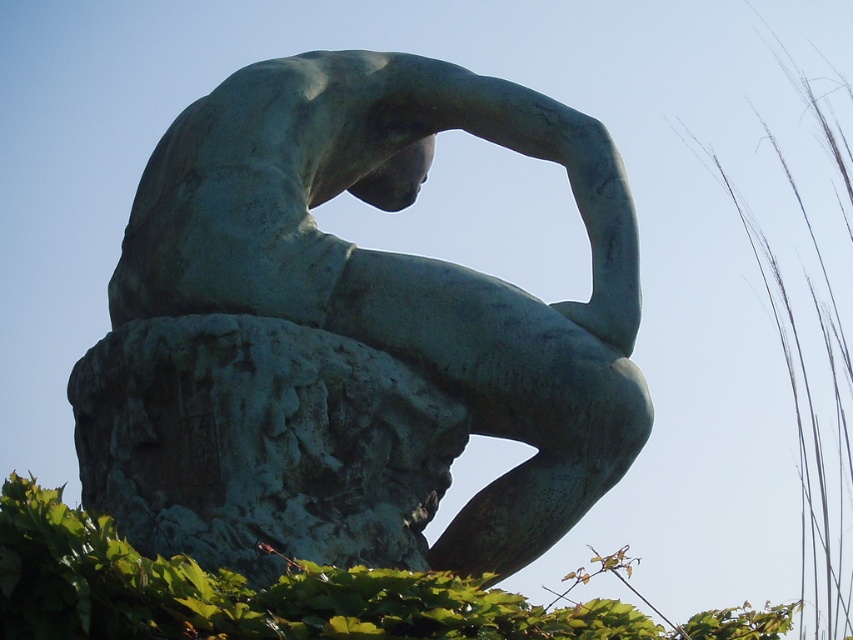
You are a landscape architect planning to install a new pathway between the green patina stone sculpture at center and the green leafy hedge at lower left. The pathway requires a minimum of 7 meters to be functional. Based on the scene, will the available space between these two objects accommodate the pathway?

The distance between the green patina stone sculpture at center and the green leafy hedge at lower left is 8.02 meters, which exceeds the required 7 meters. Therefore, the pathway can be installed between them.

You are standing in a garden and see the green patina stone sculpture at center and the green leafy hedge at lower left. Which object is positioned further to the left side of the garden?

The green patina stone sculpture at center is to the left of green leafy hedge at lower left, so the sculpture is positioned further to the left side of the garden.

You are standing in front of the bronze statue and want to take a photo of both the green patina stone sculpture at center and the green leafy hedge at lower left. Which object should you focus on first to ensure both are in the frame?

You should focus on the green patina stone sculpture at center first because it is closer to you than the green leafy hedge at lower left, so adjusting the camera to include it will also capture the hedge in the background.